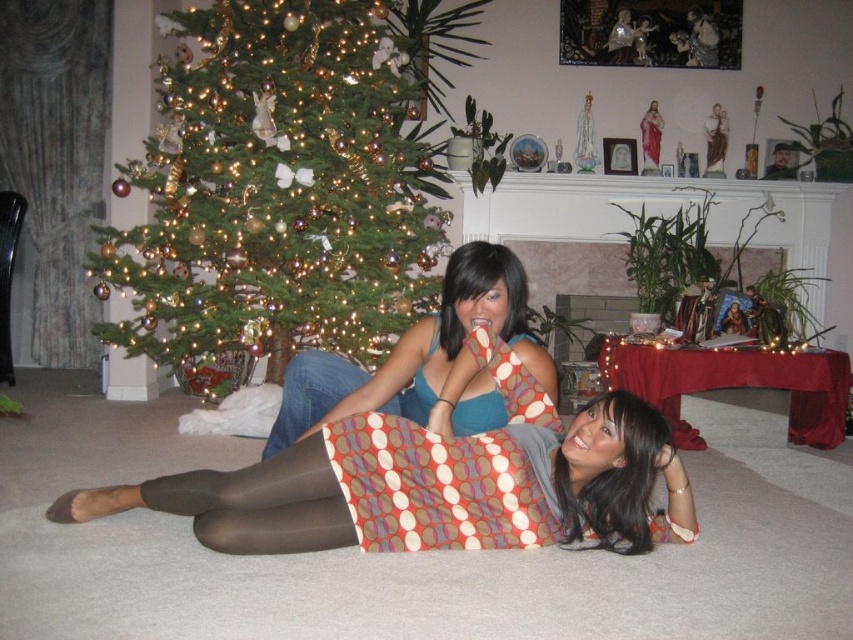
You are standing in front of the Christmas tree and want to reach the shiny gold ornaments at left without moving your feet. Can you do it comfortably?

The shiny gold ornaments at left is 11.27 feet from viewer, so you can comfortably reach them without moving your feet as they are within a reachable distance.

You are standing in the holiday scene with the decorated Christmas tree on the left. You notice a point at coordinates [428,490]. According to the image, what object is this point located on?

The point at coordinates [428,490] is located on the polka dot skirt at center.